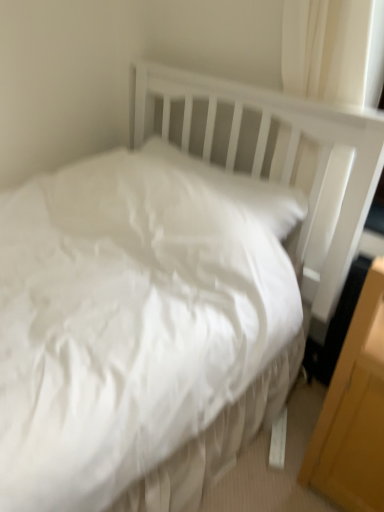
Question: From a real-world perspective, is white soft pillow at upper center below white fabric curtain at upper right?

Choices:
 (A) yes
 (B) no

Answer: (A)

Question: Can you confirm if white soft pillow at upper center is positioned to the left of white fabric curtain at upper right?

Choices:
 (A) yes
 (B) no

Answer: (A)

Question: Is white soft pillow at upper center positioned far away from white fabric curtain at upper right?

Choices:
 (A) yes
 (B) no

Answer: (B)

Question: Is white fabric curtain at upper right a part of white soft pillow at upper center?

Choices:
 (A) yes
 (B) no

Answer: (B)

Question: Does white soft pillow at upper center turn towards white fabric curtain at upper right?

Choices:
 (A) no
 (B) yes

Answer: (A)

Question: Considering the relative sizes of white soft pillow at upper center and white fabric curtain at upper right in the image provided, is white soft pillow at upper center thinner than white fabric curtain at upper right?

Choices:
 (A) no
 (B) yes

Answer: (A)

Question: Can you confirm if yellow wood/file cabinet at lower right is wider than white soft pillow at upper center?

Choices:
 (A) yes
 (B) no

Answer: (A)

Question: Is yellow wood/file cabinet at lower right thinner than white soft pillow at upper center?

Choices:
 (A) yes
 (B) no

Answer: (B)

Question: From the image's perspective, does yellow wood/file cabinet at lower right appear lower than white soft pillow at upper center?

Choices:
 (A) yes
 (B) no

Answer: (A)

Question: Can you confirm if yellow wood/file cabinet at lower right is smaller than white soft pillow at upper center?

Choices:
 (A) yes
 (B) no

Answer: (B)

Question: Can you confirm if yellow wood/file cabinet at lower right is bigger than white soft pillow at upper center?

Choices:
 (A) yes
 (B) no

Answer: (A)

Question: From the image's perspective, would you say yellow wood/file cabinet at lower right is positioned over white soft pillow at upper center?

Choices:
 (A) no
 (B) yes

Answer: (A)

Question: Is white fabric curtain at upper right wider than yellow wood/file cabinet at lower right?

Choices:
 (A) yes
 (B) no

Answer: (B)